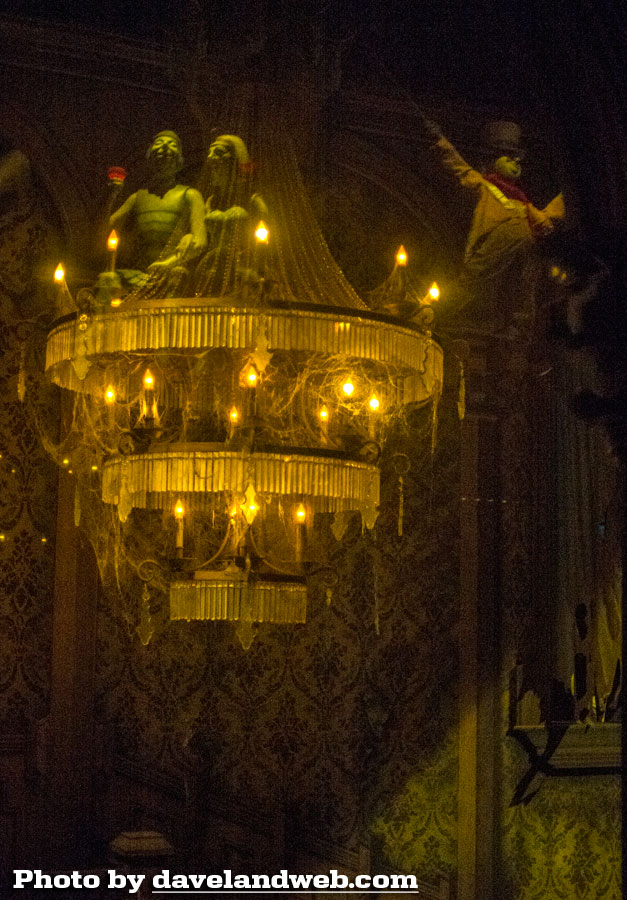
The height and width of the screenshot is (900, 627). I want to click on wall pillars, so tap(63, 591), tap(477, 642).